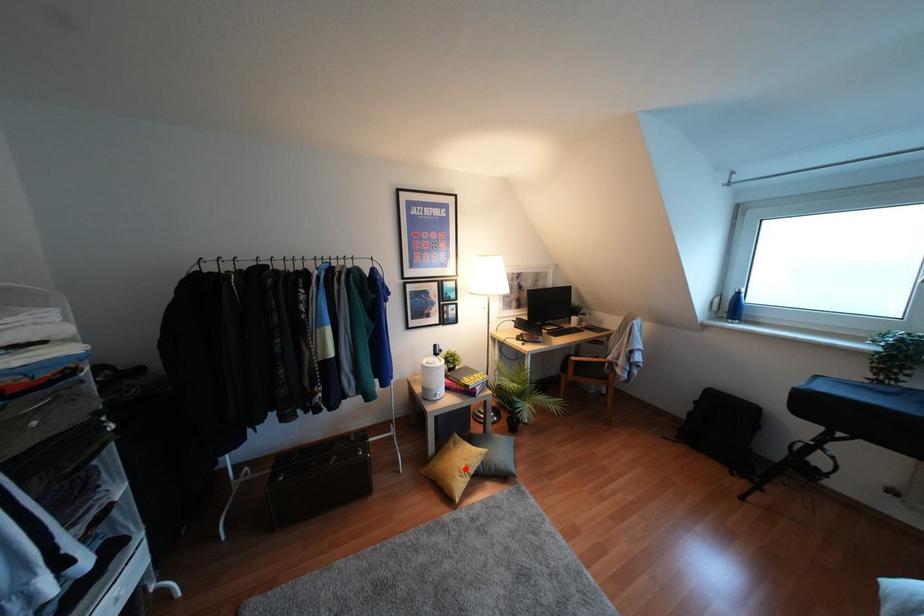
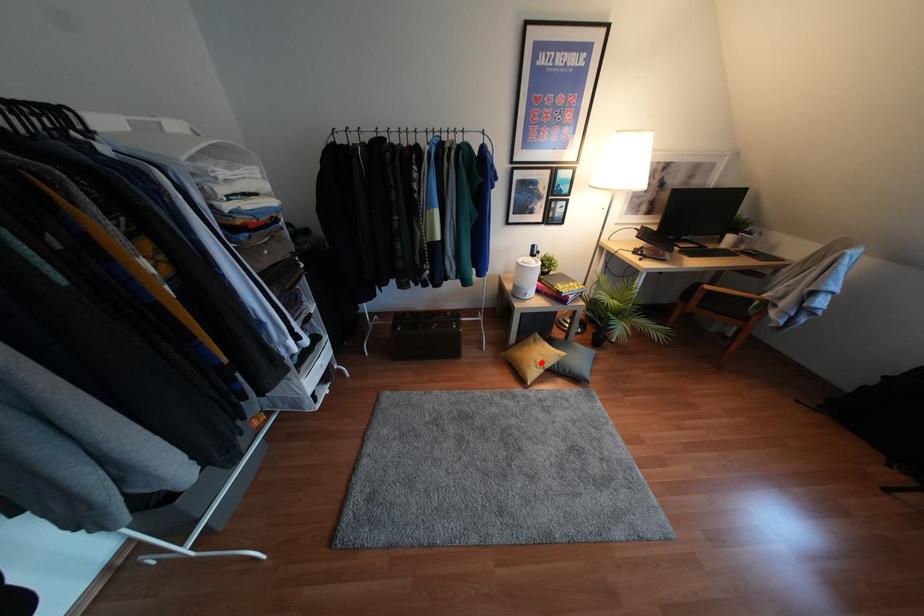
I am providing you with two images of the same scene from different viewpoints. A red point is marked on the first image and another point is marked on the second image. Does the point marked in image1 correspond to the same location as the one in image2?

Yes